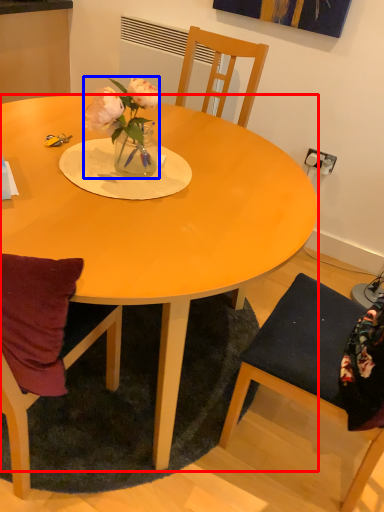
Question: Which object is further to the camera taking this photo, desk (highlighted by a red box) or houseplant (highlighted by a blue box)?

Choices:
 (A) desk
 (B) houseplant

Answer: (B)